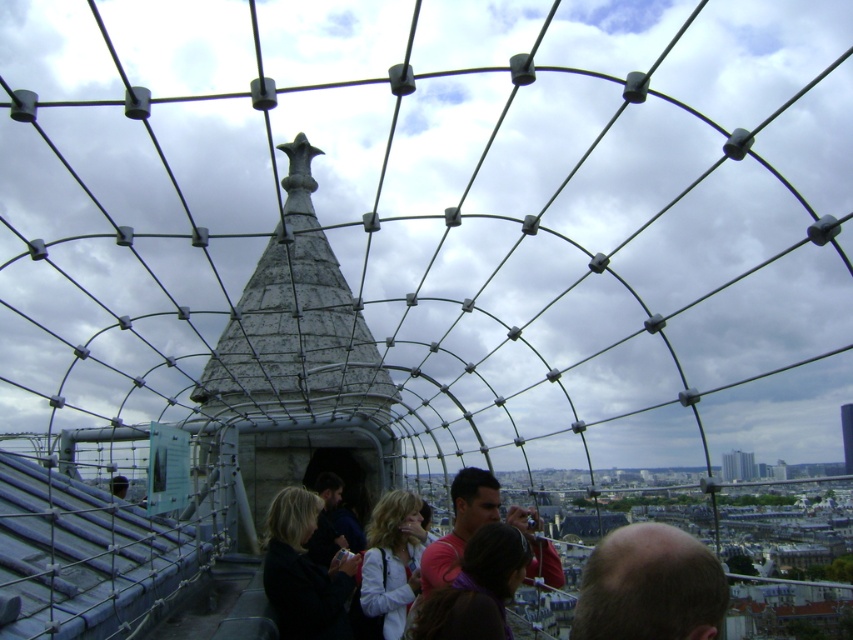
Question: Is bald head at center thinner than dark gray jacket at center?

Choices:
 (A) yes
 (B) no

Answer: (B)

Question: Based on their relative distances, which object is nearer to the blonde hair at center?

Choices:
 (A) bald head at center
 (B) dark gray jacket at center

Answer: (B)

Question: Observing the image, what is the correct spatial positioning of bald head at center in reference to blonde hair at center?

Choices:
 (A) above
 (B) below

Answer: (A)

Question: Estimate the real-world distances between objects in this image. Which object is closer to the bald head at center?

Choices:
 (A) blonde hair at center
 (B) dark gray jacket at center

Answer: (A)

Question: Which point is farther to the camera?

Choices:
 (A) dark gray jacket at center
 (B) bald head at center

Answer: (A)

Question: Is bald head at center bigger than dark gray jacket at center?

Choices:
 (A) no
 (B) yes

Answer: (B)